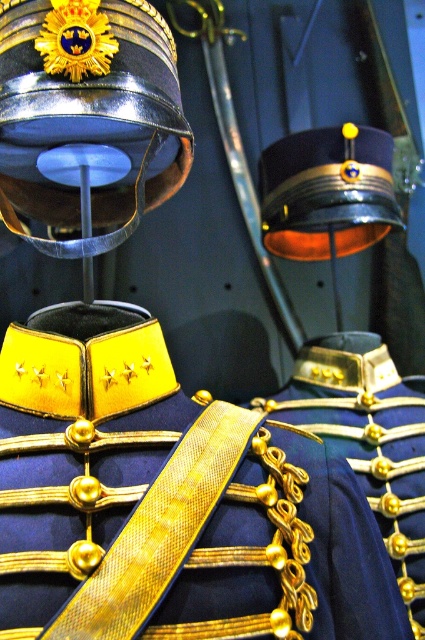
You are a museum curator arranging an exhibit. You need to place a label next to the navy blue fabric with gold trim at center and the gold metallic chain at center. Since the label must be placed to the right of the wider object, where should you position it?

The navy blue fabric with gold trim at center is wider than the gold metallic chain at center, so the label should be placed to the right of the navy blue fabric with gold trim at center.

You are a museum curator planning to install a new display case. The display case has a height limit of 30 cm. You need to place both the metallic gold helmet at upper center and the gold metallic chain at center inside. Based on their sizes, can both items fit vertically in the display case without exceeding the height limit?

The metallic gold helmet at upper center is not as tall as the gold metallic chain at center. Since the height limit is 30 cm, if the taller item, the gold metallic chain at center, is under 30 cm, both can fit. However, if the gold metallic chain at center exceeds 30 cm, then they cannot. The exact height of each item isn

You are a museum curator arranging a display. You need to place a decorative plaque at the exact center of the navy blue fabric with gold trim at center. What are the coordinates where you should place the plaque?

The coordinates for placing the plaque should be at point (169, 500), as this is the exact center of the navy blue fabric with gold trim at center.